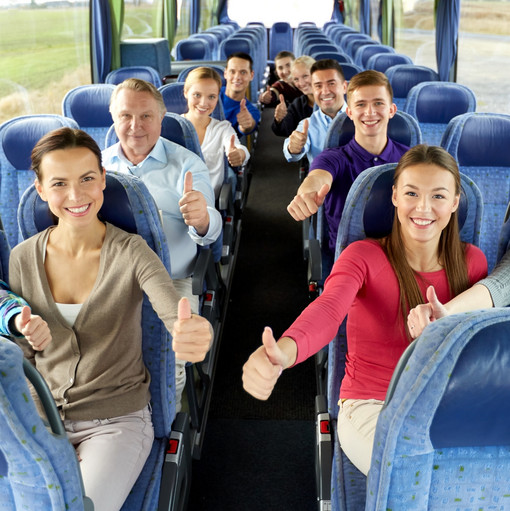
I want to click on windows, so (x=473, y=62), (x=411, y=37), (x=371, y=18), (x=351, y=10), (x=289, y=8), (x=48, y=32), (x=137, y=14), (x=209, y=12), (x=186, y=14).